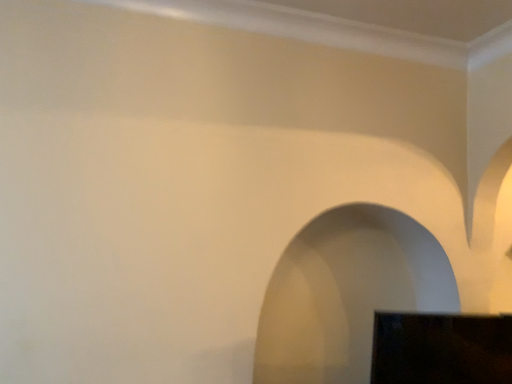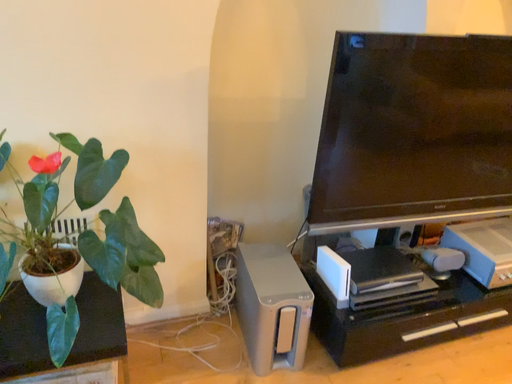
Question: How did the camera likely rotate when shooting the video?

Choices:
 (A) rotated upward
 (B) rotated downward

Answer: (B)